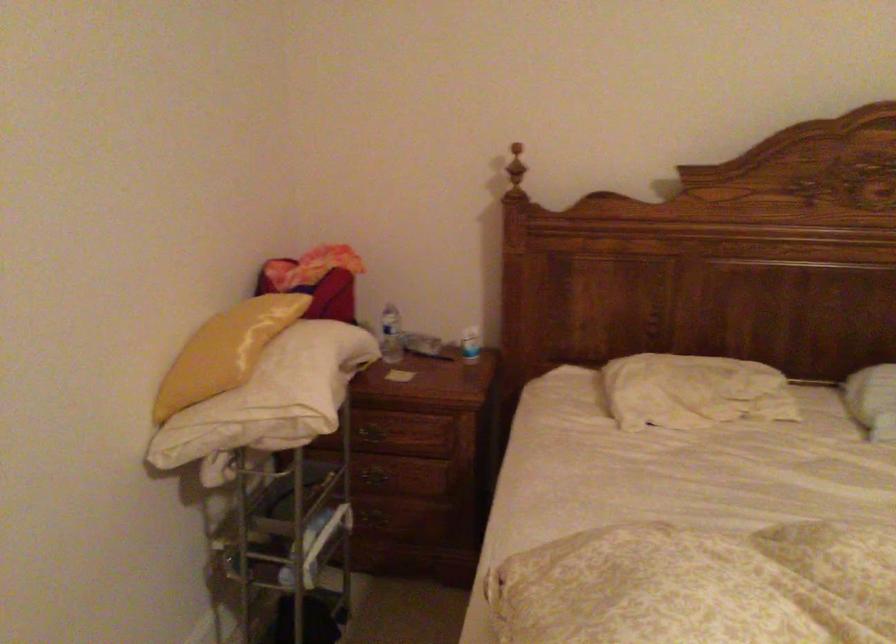
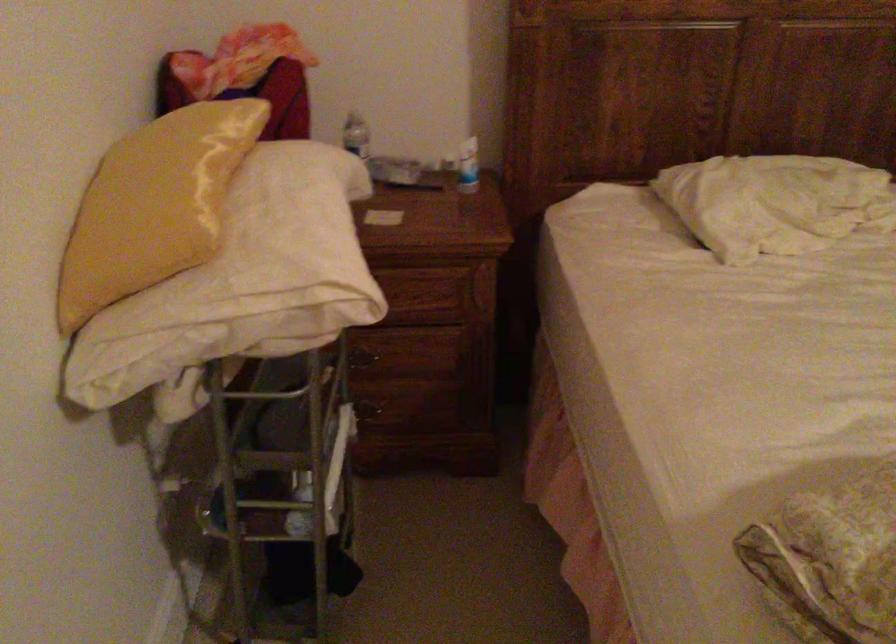
Question: I am providing you with two images of the same scene from different viewpoints. Which of the following objects are not visible in image2?

Choices:
 (A) plastic water bottle
 (B) red container handle
 (C) white spray can
 (D) drawer handle

Answer: (D)